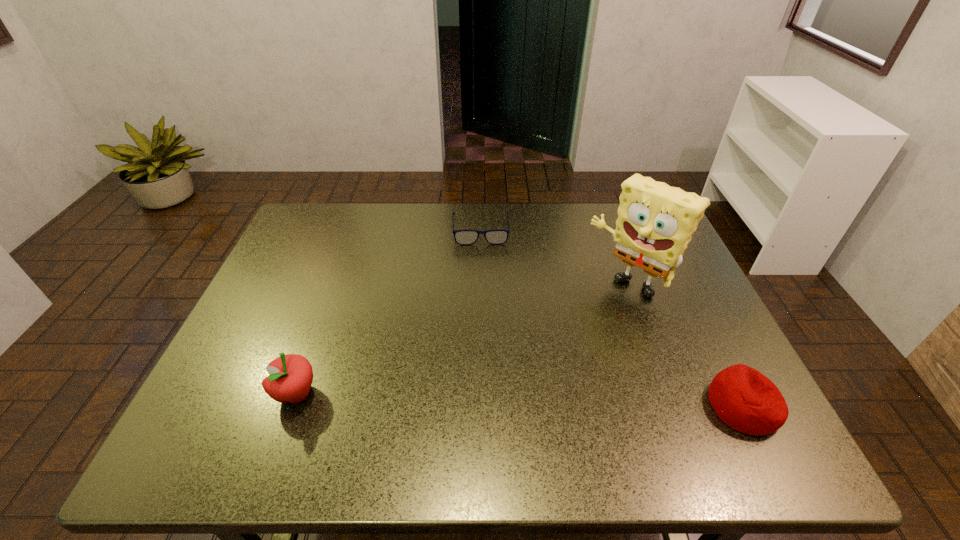
Locate an element on the screen. Image resolution: width=960 pixels, height=540 pixels. empty space that is in between the second shortest object and the apple is located at coordinates (520, 400).

The height and width of the screenshot is (540, 960). What are the coordinates of `free space between the shortest object and the second farthest object` in the screenshot? It's located at (555, 257).

Identify the location of free space that is in between the third shortest object and the shortest object. (389, 312).

Where is `empty space that is in between the apple and the beanbag`? empty space that is in between the apple and the beanbag is located at coordinates (520, 400).

This screenshot has height=540, width=960. I want to click on free space between the second shortest object and the sponge, so click(685, 345).

This screenshot has height=540, width=960. Identify the location of unoccupied position between the third tallest object and the leftmost object. [520, 400].

Where is `empty space between the tallest object and the farthest object`? This screenshot has width=960, height=540. empty space between the tallest object and the farthest object is located at coordinates (555, 257).

This screenshot has height=540, width=960. Find the location of `empty location between the beanbag and the leftmost object`. empty location between the beanbag and the leftmost object is located at coordinates (520, 400).

I want to click on the third closest object relative to the second farthest object, so click(290, 377).

Point out which object is positioned as the third nearest to the apple. Please provide its 2D coordinates. Your answer should be formatted as a tuple, i.e. [(x, y)], where the tuple contains the x and y coordinates of a point satisfying the conditions above.

[(746, 400)]